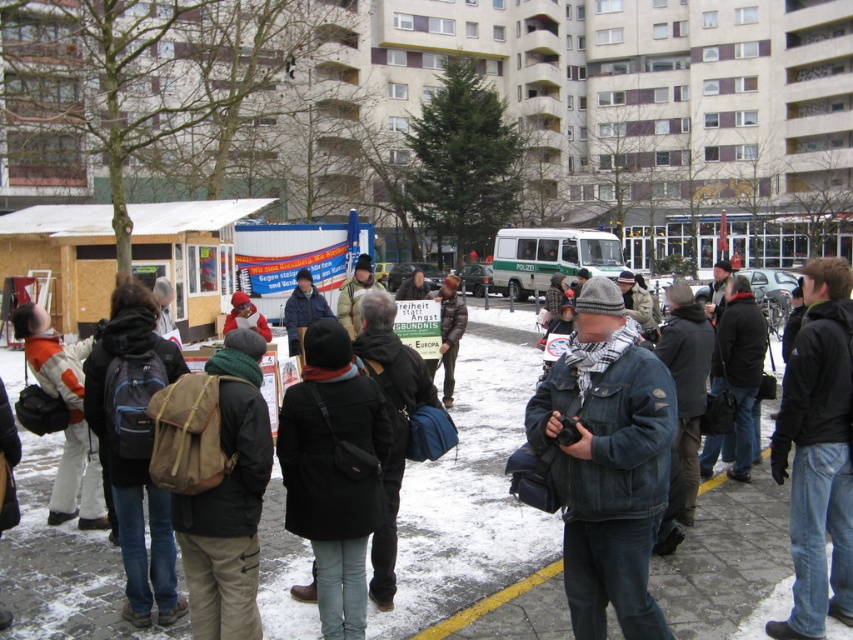
You are standing in the winter scene and notice a person wearing a denim jacket at center and dark blue jeans at center. Which piece of clothing is nearer to you?

The denim jacket at center is closer to the viewer than the dark blue jeans at center.

You are a fashion designer who wants to create a winter outfit using the denim jacket at center and dark blue jeans at center. Given that the distance between them is 4.38 feet, can you determine if they are close enough to be worn together as a coordinated set?

The denim jacket at center and dark blue jeans at center are 4.38 feet apart, which is too far for them to be worn together as a coordinated set since clothing items need to be on the same person to be paired. The distance suggests they belong to different individuals.